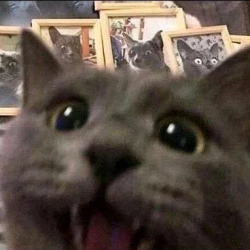
The width and height of the screenshot is (250, 250). Find the location of `wooden frame`. wooden frame is located at coordinates (x=106, y=38).